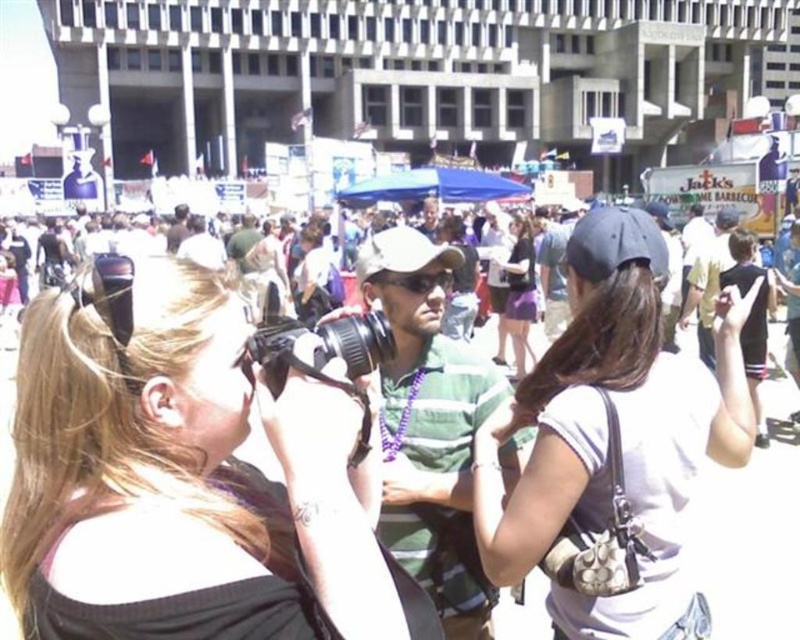
Question: Which object is closer to the camera taking this photo?

Choices:
 (A) black fabric baseball cap at center-right
 (B) blonde hair at center
 (C) purple matte skirt at center
 (D) black plastic camera at center

Answer: (B)

Question: Among these objects, which one is farthest from the camera?

Choices:
 (A) black fabric baseball cap at center-right
 (B) blonde hair at center
 (C) black plastic camera at center
 (D) matte black camera at center

Answer: (D)

Question: Considering the relative positions of black plastic camera at center and black fabric baseball cap at center-right in the image provided, where is black plastic camera at center located with respect to black fabric baseball cap at center-right?

Choices:
 (A) above
 (B) below

Answer: (B)

Question: Where is blonde hair at center located in relation to black plastic camera at center in the image?

Choices:
 (A) right
 (B) left

Answer: (A)

Question: Is blonde hair at center positioned in front of white matte baseball cap at center?

Choices:
 (A) yes
 (B) no

Answer: (A)

Question: Which of the following is the closest to the observer?

Choices:
 (A) white matte purse at center
 (B) black plastic camera at center
 (C) black fabric baseball cap at center-right
 (D) blonde hair at center

Answer: (D)